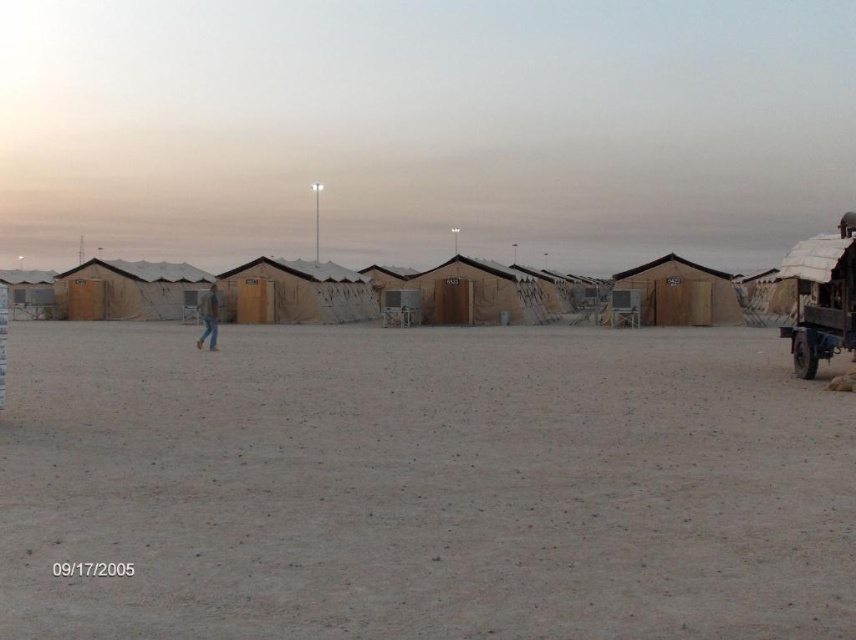
Question: Estimate the real-world distances between objects in this image. Which object is farther from the brown wood cabin at center-right?

Choices:
 (A) jeans at center
 (B) dull brown dirt at center

Answer: (B)

Question: Where is dull brown dirt at center located in relation to brown wood cabin at center-right in the image?

Choices:
 (A) left
 (B) right

Answer: (A)

Question: Can you confirm if dull brown dirt at center is positioned to the left of brown wood cabin at center-right?

Choices:
 (A) yes
 (B) no

Answer: (A)

Question: In this image, where is dull brown dirt at center located relative to brown wood cabin at center-right?

Choices:
 (A) above
 (B) below

Answer: (B)

Question: Which of the following is the closest to the observer?

Choices:
 (A) (143, 541)
 (B) (214, 298)

Answer: (A)

Question: Which object appears closest to the camera in this image?

Choices:
 (A) jeans at center
 (B) dull brown dirt at center
 (C) brown wood cabin at center-right

Answer: (B)